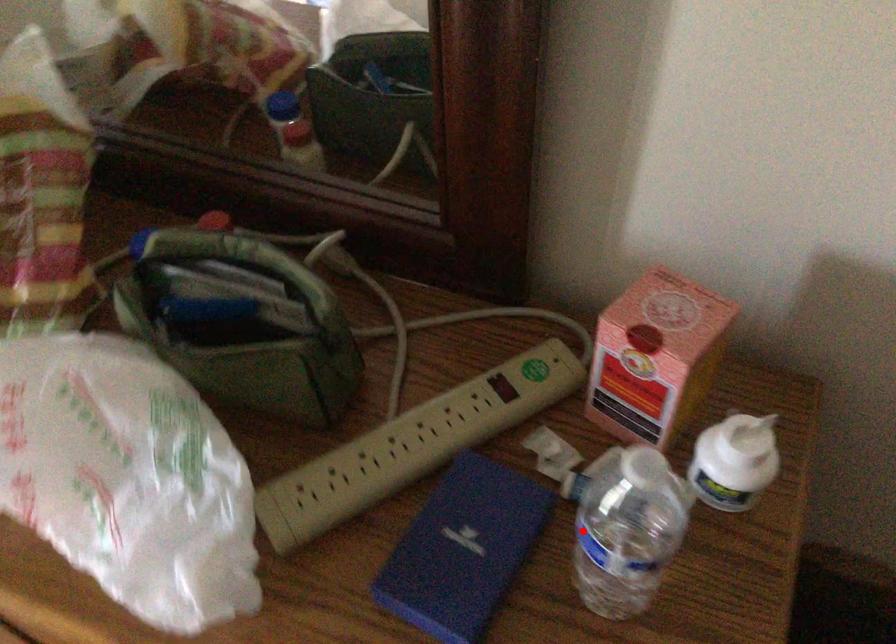
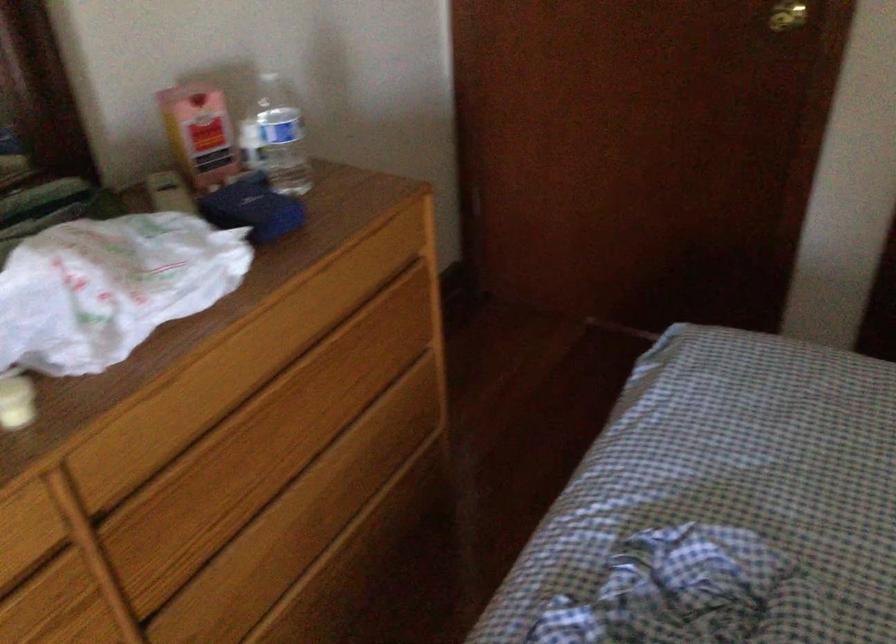
In the second image, find the point that corresponds to the highlighted location in the first image.

(276, 138)